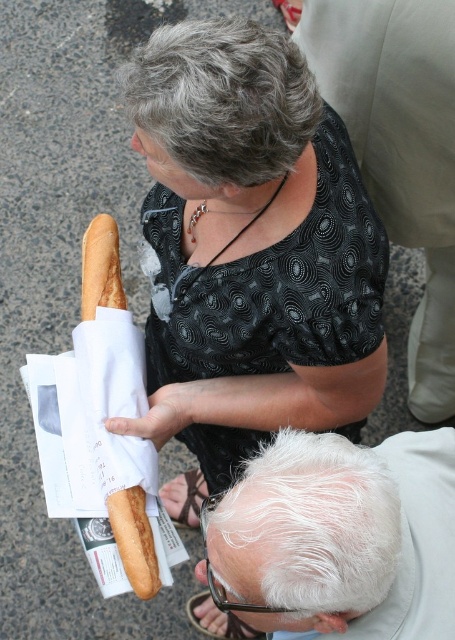
Which is more to the right, white hair at lower center or golden brown bread at left?

white hair at lower center is more to the right.

Which of these two, white hair at lower center or golden brown bread at left, stands taller?

white hair at lower center

Is point (288, 484) farther from viewer compared to point (132, 508)?

No.

I want to click on white hair at lower center, so click(x=342, y=538).

Is matte black blouse at upper center taller than white hair at lower center?

Yes, matte black blouse at upper center is taller than white hair at lower center.

Is matte black blouse at upper center shorter than white hair at lower center?

Incorrect, matte black blouse at upper center's height does not fall short of white hair at lower center's.

This screenshot has height=640, width=455. I want to click on matte black blouse at upper center, so click(x=248, y=253).

The width and height of the screenshot is (455, 640). In order to click on matte black blouse at upper center in this screenshot , I will do coord(248,253).

Is matte black blouse at upper center below golden brown bread at left?

Yes.

Does matte black blouse at upper center appear on the left side of golden brown bread at left?

No, matte black blouse at upper center is not to the left of golden brown bread at left.

Who is more forward, [313,129] or [131,522]?

Point [313,129] is more forward.

This screenshot has width=455, height=640. Find the location of `matte black blouse at upper center`. matte black blouse at upper center is located at coordinates (248, 253).